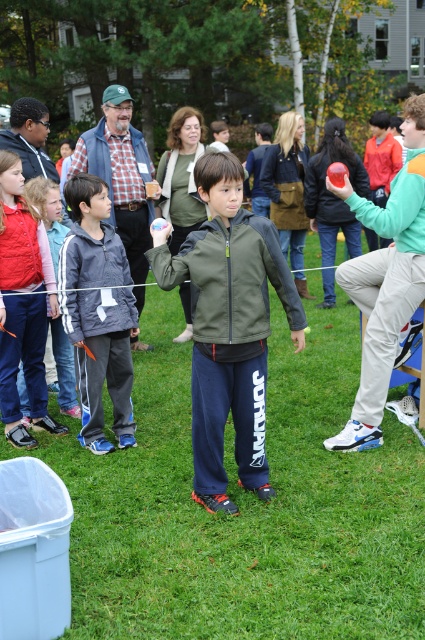
You are a photographer trying to capture a clear shot of the matte plastic ball at center without the green grass at center blocking it. What adjustment should you make to your camera position?

Since the green grass at center is in front of the matte plastic ball at center, you should move your camera position backward to ensure the matte plastic ball at center is not obscured by the green grass at center.

You are a photographer trying to capture a photo of the matte green jacket at center and the matte plastic ball at center. According to the scene, where should you position the matte plastic ball relative to the matte green jacket to ensure it appears in the correct location in your photo?

The matte plastic ball at center should be positioned on the right side of the matte green jacket at center to match the scene.